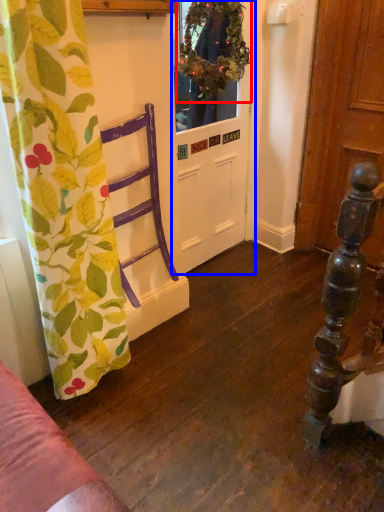
Question: Which object appears farthest to the camera in this image, floral arrangement (highlighted by a red box) or door (highlighted by a blue box)?

Choices:
 (A) floral arrangement
 (B) door

Answer: (B)